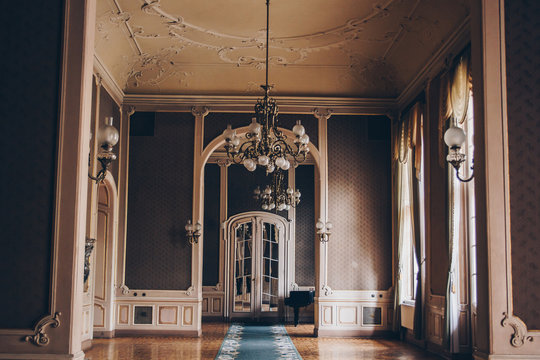
Identify the location of blue runner rug. This screenshot has height=360, width=540. (270, 349).